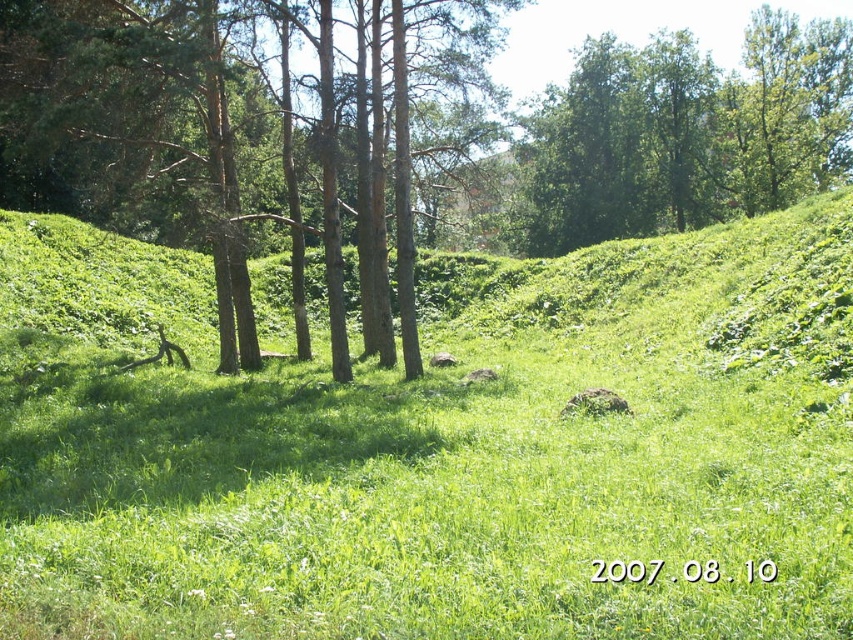
You are a hiker standing in the meadow and want to take a photo of both the green bark tree at center and the green leafy tree at upper center. Which tree should you move closer to in order to include both in your camera frame?

Since the green bark tree at center occupies less space than the green leafy tree at upper center, you should move closer to the green bark tree at center to ensure both trees fit within the camera frame.

You are standing in the meadow and want to find the taller tree between the green bark tree at center and the green leafy tree at upper center. Which one should you look up to?

The green leafy tree at upper center is taller than the green bark tree at center, so you should look up to the green leafy tree at upper center.

You are planning to set up a picnic blanket in the green grassy area at center. Considering the space available, will the green grassy at center provide enough room for the blanket compared to the green bark tree at center?

The green grassy at center is wider than the green bark tree at center, so it will provide sufficient space for the picnic blanket.